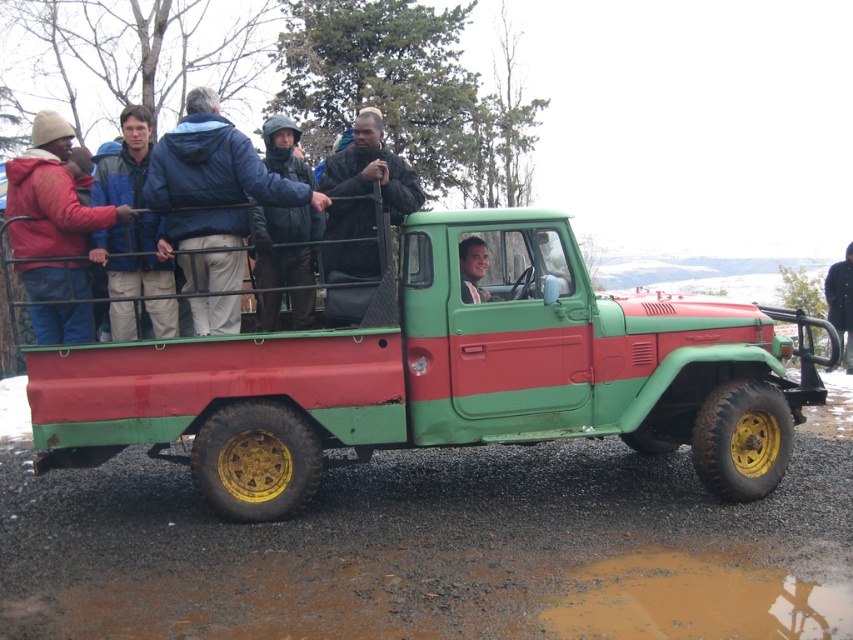
Does point (317, 388) come in front of point (393, 180)?

Yes, point (317, 388) is closer to viewer.

Locate an element on the screen. green matte truck at center is located at coordinates (442, 378).

Find the location of a particular element. Image resolution: width=853 pixels, height=640 pixels. green matte truck at center is located at coordinates (442, 378).

Who is lower down, dark brown leather jacket at center or black fabric jacket at upper center?

black fabric jacket at upper center is lower down.

Is dark brown leather jacket at center wider than black fabric jacket at upper center?

Correct, the width of dark brown leather jacket at center exceeds that of black fabric jacket at upper center.

Does point (398, 172) come behind point (838, 304)?

No, (398, 172) is in front of (838, 304).

The image size is (853, 640). What are the coordinates of `dark brown leather jacket at center` in the screenshot? It's located at (370, 168).

Can you confirm if blue fleece jacket at left is positioned above dark brown leather jacket at center?

Incorrect, blue fleece jacket at left is not positioned above dark brown leather jacket at center.

Between point (119, 184) and point (352, 141), which one is positioned behind?

The point (352, 141) is more distant.

This screenshot has width=853, height=640. Find the location of `blue fleece jacket at left`. blue fleece jacket at left is located at coordinates (132, 257).

At what (x,y) coordinates should I click in order to perform the action: click on blue fleece jacket at left. Please return your answer as a coordinate pair (x, y). Looking at the image, I should click on (132, 257).